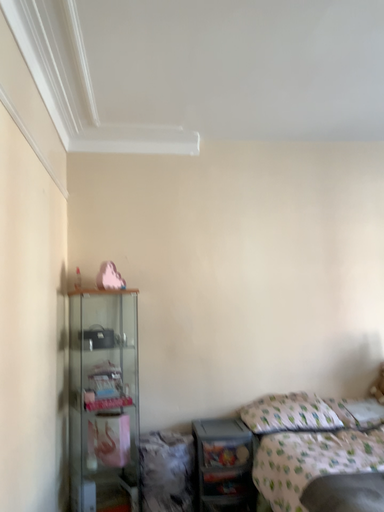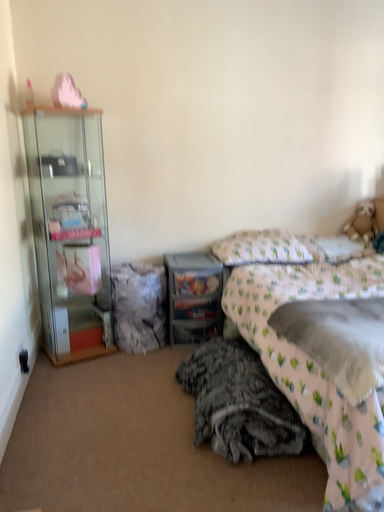
Question: How did the camera likely rotate when shooting the video?

Choices:
 (A) rotated upward
 (B) rotated downward

Answer: (B)